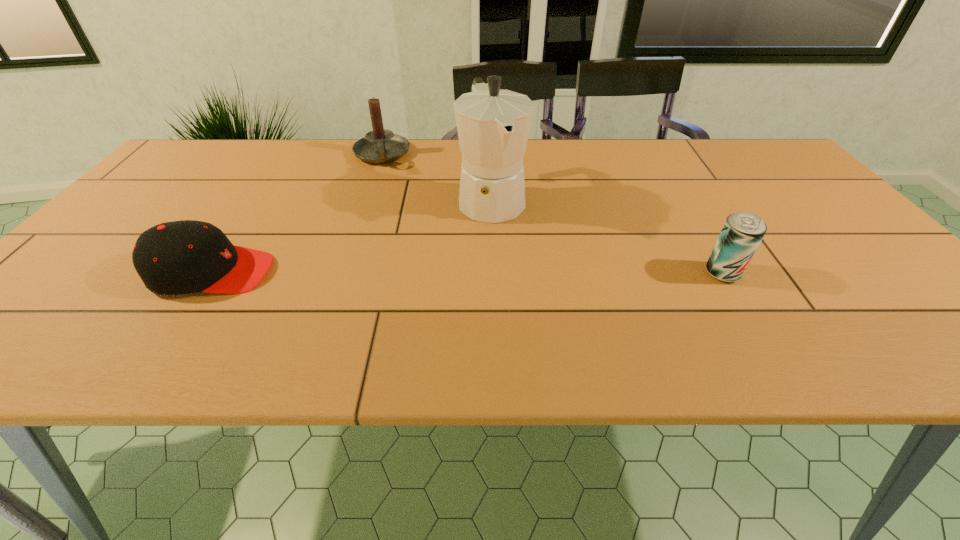
Locate an element on the screen. The width and height of the screenshot is (960, 540). vacant space situated on the side of the second tallest object with the handle loop is located at coordinates (385, 191).

Find the location of `vacant region located 0.240m on the side of the second tallest object with the handle loop`. vacant region located 0.240m on the side of the second tallest object with the handle loop is located at coordinates (389, 218).

Locate an element on the screen. The image size is (960, 540). free spot located 0.300m at the spout of the coffeepot is located at coordinates (547, 322).

Identify the location of free region located 0.150m at the spout of the coffeepot. (522, 271).

This screenshot has height=540, width=960. What are the coordinates of `free space located at the spout of the coffeepot` in the screenshot? It's located at (525, 278).

The image size is (960, 540). I want to click on candle that is positioned at the far edge, so click(x=380, y=145).

Where is `coffeepot located at the far edge`? This screenshot has height=540, width=960. coffeepot located at the far edge is located at coordinates [493, 125].

In order to click on object present at the near edge in this screenshot , I will do `click(173, 258)`.

This screenshot has width=960, height=540. I want to click on free region at the far edge, so tap(627, 147).

This screenshot has width=960, height=540. In the image, there is a desktop. Find the location of `vacant space at the near edge`. vacant space at the near edge is located at coordinates (x=782, y=314).